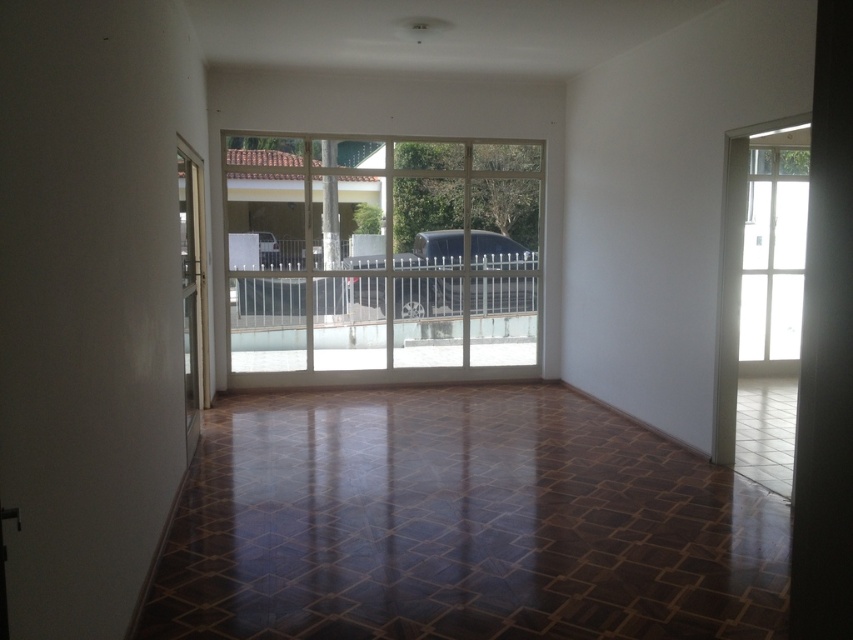
Question: Where is clear glass terrace at center located in relation to white glass door at left in the image?

Choices:
 (A) right
 (B) left

Answer: (A)

Question: Does transparent glass door at right appear on the right side of white glass door at left?

Choices:
 (A) yes
 (B) no

Answer: (A)

Question: Where is transparent glass door at right located in relation to white glass door at left in the image?

Choices:
 (A) above
 (B) below

Answer: (B)

Question: Among these points, which one is nearest to the camera?

Choices:
 (A) (183, 253)
 (B) (434, 307)
 (C) (782, 193)
 (D) (396, 220)

Answer: (A)

Question: Which point is farther to the camera?

Choices:
 (A) white metal rail at center
 (B) clear glass terrace at center
 (C) white glass door at left

Answer: (A)

Question: Which point is farther to the camera?

Choices:
 (A) (194, 291)
 (B) (512, 276)
 (C) (767, 125)
 (D) (527, 323)

Answer: (D)